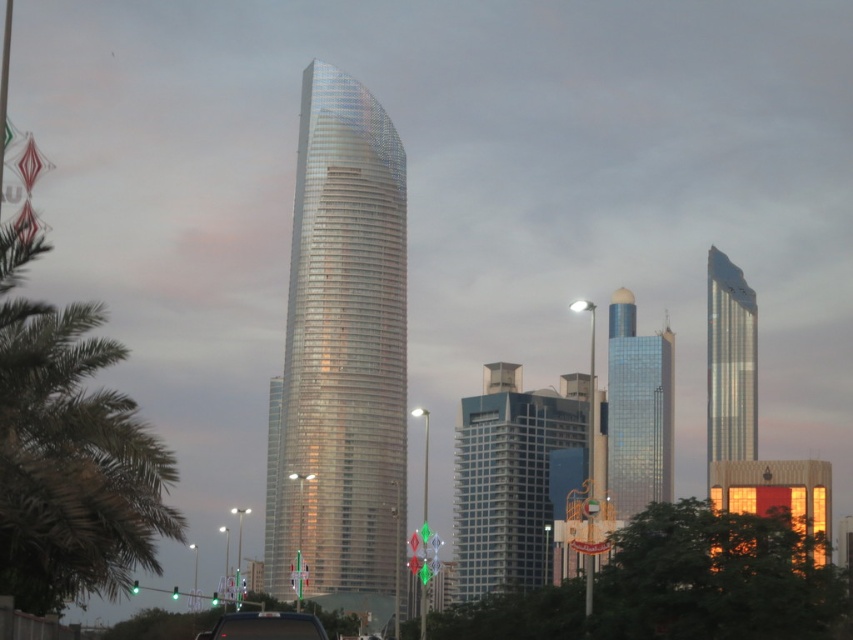
Question: Does green leafy palm tree at left come behind black glossy car at center?

Choices:
 (A) no
 (B) yes

Answer: (B)

Question: Which of the following is the farthest from the observer?

Choices:
 (A) (218, 628)
 (B) (308, 406)

Answer: (B)

Question: Which point appears farthest from the camera in this image?

Choices:
 (A) (520, 500)
 (B) (642, 467)
 (C) (219, 632)

Answer: (B)

Question: Is shiny glass tower at center bigger than blue glass building at center?

Choices:
 (A) yes
 (B) no

Answer: (A)

Question: Estimate the real-world distances between objects in this image. Which object is farther from the glossy glass skyscraper at center?

Choices:
 (A) shiny metallic skyscraper at right
 (B) green leafy palm tree at left
 (C) shiny glass tower at center

Answer: (B)

Question: Is shiny glass tower at center below glossy glass skyscraper at center?

Choices:
 (A) no
 (B) yes

Answer: (A)